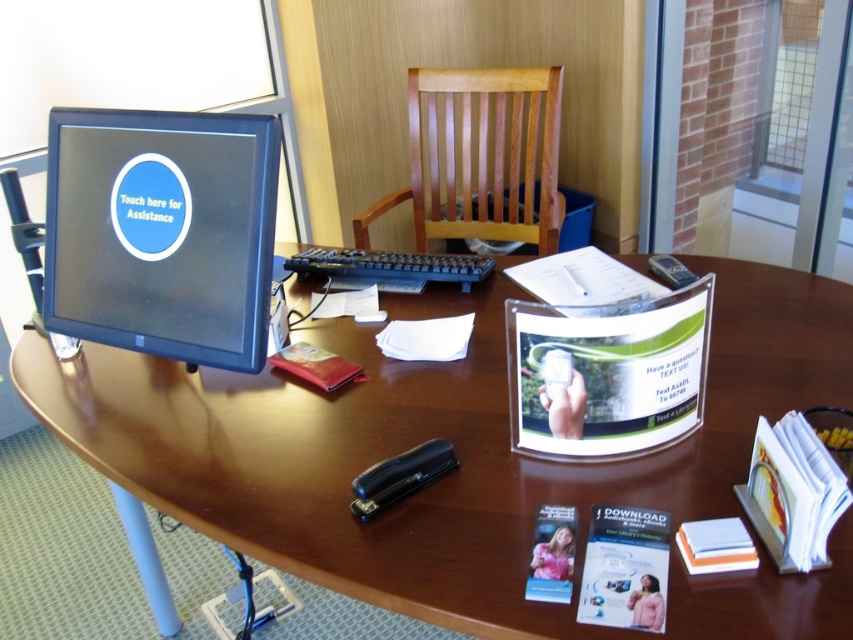
What object is located at the coordinates point (161, 232) on the desk?

The point (161, 232) indicates the location of the matte black monitor at left.

You are a person of average height standing at the wooden computer desk at center. Can you easily see the matte black monitor at left without bending down?

The wooden computer desk at center is taller than the matte black monitor at left, so yes, you can easily see the matte black monitor at left without bending down because it is positioned lower than the desk surface.

You are a person who wants to sit down and use the computer. You see the wooden slats chair at center and the black plastic keyboard at center. How far apart are they?

The wooden slats chair at center and the black plastic keyboard at center are 34.50 inches apart.